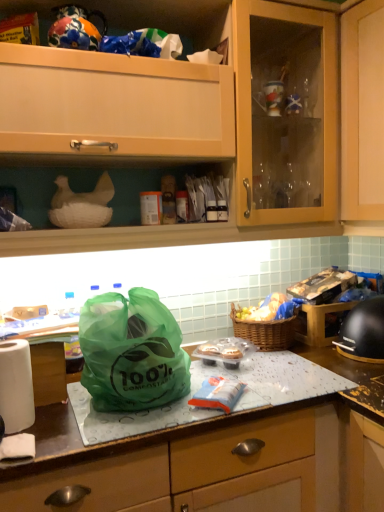
Question: Looking at the image, does matte wood cabinet at upper center seem bigger or smaller compared to yellowish matte bread at right?

Choices:
 (A) big
 (B) small

Answer: (A)

Question: Is matte wood cabinet at upper center in front of or behind yellowish matte bread at right in the image?

Choices:
 (A) front
 (B) behind

Answer: (A)

Question: Which is farther from the yellowish matte bread at right?

Choices:
 (A) white paper towel at left
 (B) matte wood cabinet at upper center
 (C) black matte helmet at right
 (D) matte plastic bag at center
 (E) green compostable bag at center

Answer: (A)

Question: Which object is the farthest from the black matte helmet at right?

Choices:
 (A) matte plastic bag at center
 (B) white paper towel at left
 (C) green compostable bag at center
 (D) woven brown picnic basket at center
 (E) matte wood cabinet at upper center

Answer: (B)